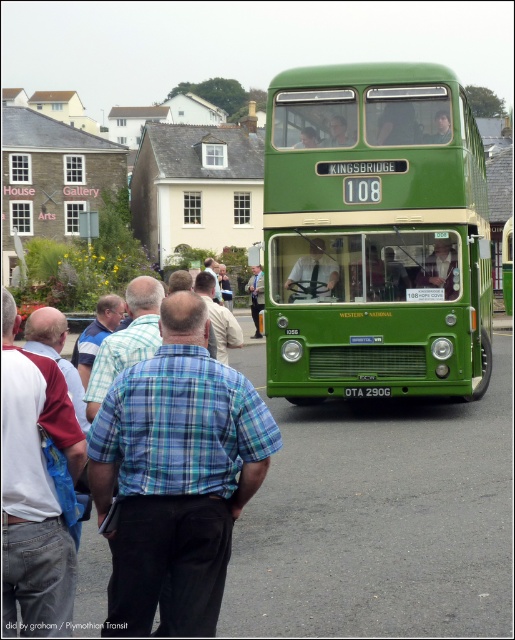
You are a photographer standing in front of the green matte bus at center and the blue plaid shirt at center. You want to take a photo that includes both subjects. Which subject should you focus on first to ensure both are in frame?

The blue plaid shirt at center is not as tall as the green matte bus at center, so you should focus on the green matte bus at center first to ensure both are in frame.

You are a photographer standing in front of the green matte bus at center and the blue plaid shirt at center. You want to take a photo that includes both subjects. Which subject should you focus on first to ensure both are in sharp focus?

You should focus on the green matte bus at center first because it is farther away than the blue plaid shirt at center, ensuring both are in focus when using a shallow depth of field.